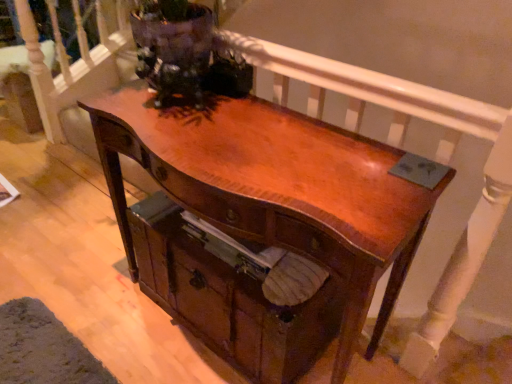
Question: Should I look upward or downward to see wooden drawer at center?

Choices:
 (A) up
 (B) down

Answer: (B)

Question: Is shiny brown wood desk at center located outside wooden drawer at center?

Choices:
 (A) no
 (B) yes

Answer: (A)

Question: Considering the relative sizes of shiny brown wood desk at center and wooden drawer at center in the image provided, is shiny brown wood desk at center taller than wooden drawer at center?

Choices:
 (A) yes
 (B) no

Answer: (A)

Question: Is the depth of shiny brown wood desk at center greater than that of wooden drawer at center?

Choices:
 (A) yes
 (B) no

Answer: (B)

Question: Does shiny brown wood desk at center have a larger size compared to wooden drawer at center?

Choices:
 (A) yes
 (B) no

Answer: (A)

Question: Does shiny brown wood desk at center have a lesser width compared to wooden drawer at center?

Choices:
 (A) yes
 (B) no

Answer: (A)

Question: Is shiny brown wood desk at center oriented towards wooden drawer at center?

Choices:
 (A) yes
 (B) no

Answer: (A)

Question: From the image's perspective, would you say wooden drawer at center is shown under shiny brown wood desk at center?

Choices:
 (A) no
 (B) yes

Answer: (B)

Question: Does wooden drawer at center have a greater height compared to shiny brown wood desk at center?

Choices:
 (A) no
 (B) yes

Answer: (A)

Question: Could you tell me if wooden drawer at center is facing shiny brown wood desk at center?

Choices:
 (A) no
 (B) yes

Answer: (B)

Question: Is wooden drawer at center located outside shiny brown wood desk at center?

Choices:
 (A) yes
 (B) no

Answer: (B)

Question: From the image's perspective, is wooden drawer at center over shiny brown wood desk at center?

Choices:
 (A) no
 (B) yes

Answer: (A)

Question: Considering the relative sizes of wooden drawer at center and shiny brown wood desk at center in the image provided, is wooden drawer at center bigger than shiny brown wood desk at center?

Choices:
 (A) yes
 (B) no

Answer: (B)

Question: Considering the positions of point (173, 299) and point (226, 192), is point (173, 299) closer or farther from the camera than point (226, 192)?

Choices:
 (A) closer
 (B) farther

Answer: (B)